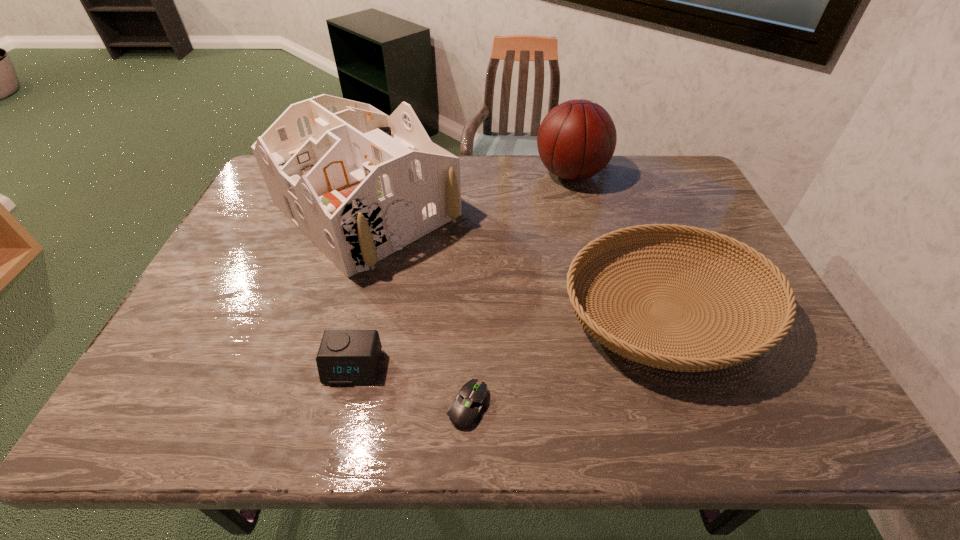
Identify which object is located as the third nearest to the dollhouse. Please provide its 2D coordinates. Your answer should be formatted as a tuple, i.e. [(x, y)], where the tuple contains the x and y coordinates of a point satisfying the conditions above.

[(711, 358)]

Where is `vacant space that satisfies the following two spatial constraints: 1. on the front side of the basket; 2. on the right side of the basketball`? vacant space that satisfies the following two spatial constraints: 1. on the front side of the basket; 2. on the right side of the basketball is located at coordinates (606, 312).